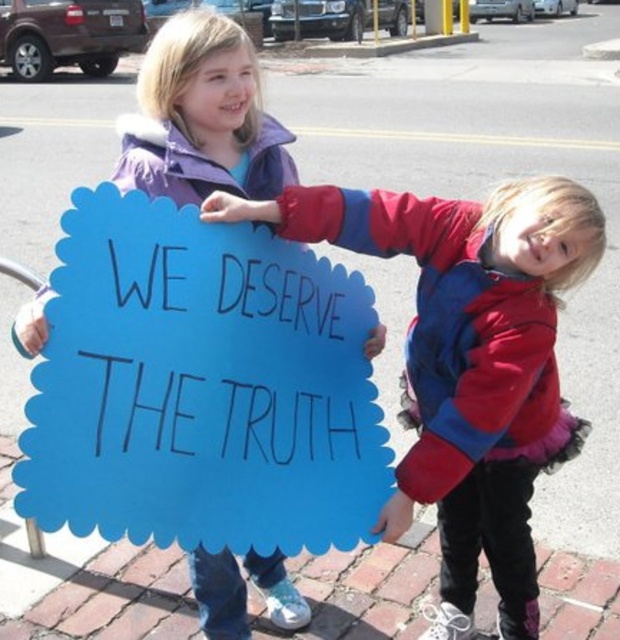
You are a photographer trying to capture both the blue paper sign at center and the blue cardboard sign at center in a single shot. Given that your camera has a minimum focus distance of 10 inches, will you be able to focus on both signs clearly?

The blue paper sign at center is 11.34 inches from the blue cardboard sign at center. Since the distance between them is greater than the camera minimum focus distance of 10 inches, the camera can focus on both signs clearly.

You are a photographer trying to capture the two points in the image. Which point, point (50, 442) or point (314, 216), would appear larger in your photo due to its proximity to the camera?

Point (50, 442) is closer to the viewer than point (314, 216), so it would appear larger in the photo.

In the scene shown: You are a photographer trying to capture both the blue paper sign at center and the blue cardboard sign at center in a single frame. Which sign should you focus on first to ensure both are visible in the photo?

The blue paper sign at center is smaller in size compared to the blue cardboard sign at center, so you should focus on the blue cardboard sign at center first to ensure both signs are visible in the photo.